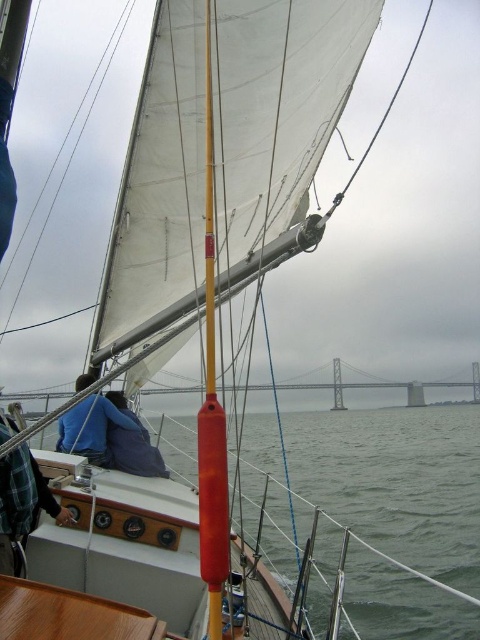
Question: Estimate the real-world distances between objects in this image. Which object is closer to the smooth orange mast at center?

Choices:
 (A) transparent water at center
 (B) gray concrete bridge at center

Answer: (A)

Question: Is smooth orange mast at center in front of gray concrete bridge at center?

Choices:
 (A) yes
 (B) no

Answer: (A)

Question: Does transparent water at center appear on the right side of smooth orange mast at center?

Choices:
 (A) no
 (B) yes

Answer: (B)

Question: Among these points, which one is nearest to the camera?

Choices:
 (A) (211, 561)
 (B) (425, 464)
 (C) (396, 384)

Answer: (A)

Question: Among these points, which one is farthest from the camera?

Choices:
 (A) [x=377, y=616]
 (B) [x=210, y=337]

Answer: (A)

Question: Where is transparent water at center located in relation to smooth orange mast at center in the image?

Choices:
 (A) right
 (B) left

Answer: (A)